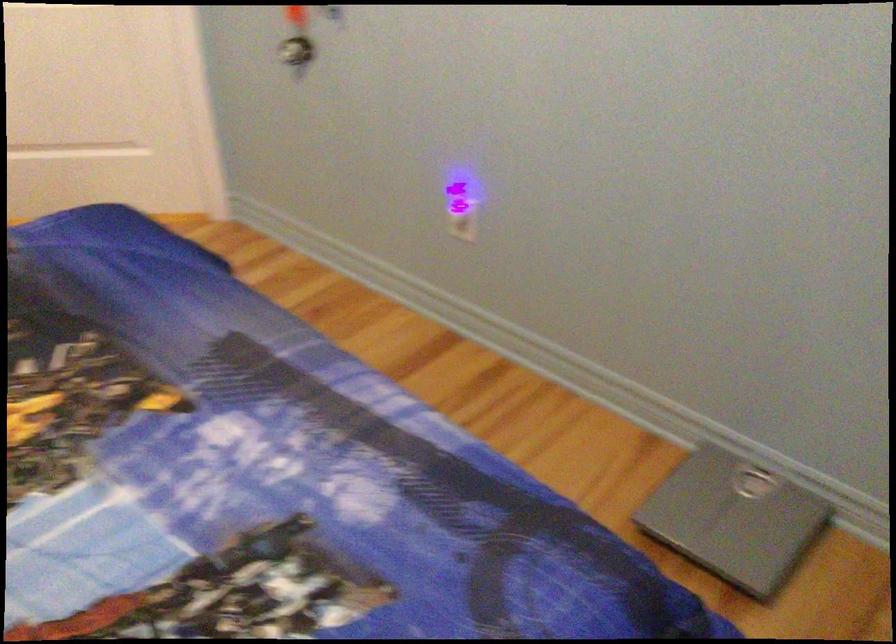
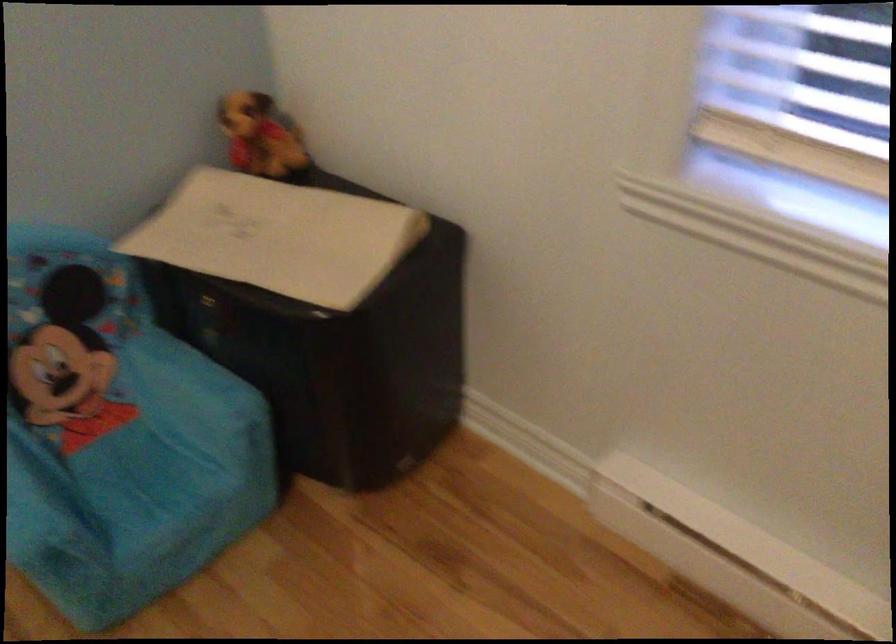
How did the camera likely rotate?

The camera's rotation is toward right-down.